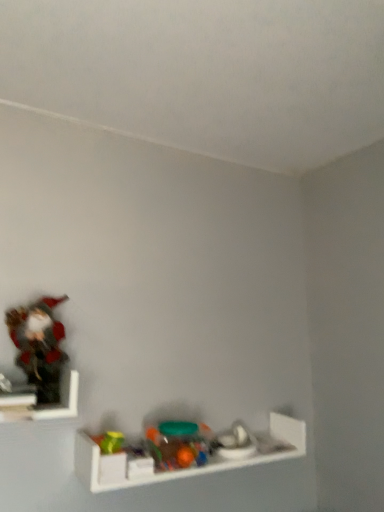
Question: From a real-world perspective, relative to translucent plastic toy at lower center, which is counted as the 3th toy, starting from the top, is translucent plastic toys at center, the second toy when ordered from right to left, vertically above or below?

Choices:
 (A) below
 (B) above

Answer: (B)

Question: In terms of height, does translucent plastic toys at center, which is counted as the second toy, starting from the bottom, look taller or shorter compared to translucent plastic toy at lower center, placed as the third toy when sorted from left to right?

Choices:
 (A) short
 (B) tall

Answer: (B)

Question: Estimate the real-world distances between objects in this image. Which object is closer to the translucent plastic toys at lower center, the 1th shelf ordered from the bottom?

Choices:
 (A) matte plastic figurine at left, acting as the 1th toy starting from the left
 (B) translucent plastic toy at lower center, marked as the 1th toy in a bottom-to-top arrangement
 (C) translucent plastic toys at center, the second toy when ordered from right to left
 (D) wooden figurine at left, which ranks as the 2th shelf in bottom-to-top order

Answer: (C)

Question: Based on their relative distances, which object is nearer to the translucent plastic toys at center, the second toy when ordered from right to left?

Choices:
 (A) wooden figurine at left, which ranks as the 2th shelf in bottom-to-top order
 (B) matte plastic figurine at left, acting as the 1th toy starting from the left
 (C) translucent plastic toys at lower center, the second shelf in the top-to-bottom sequence
 (D) translucent plastic toy at lower center, marked as the 1th toy in a bottom-to-top arrangement

Answer: (C)